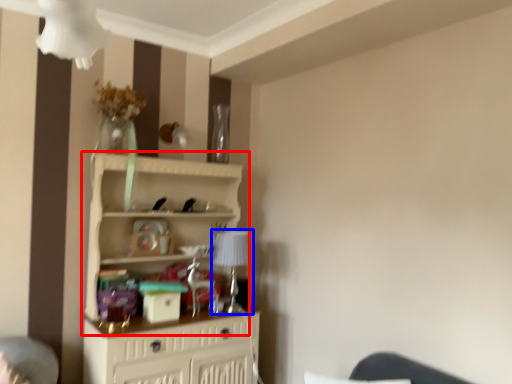
Question: Which object is closer to the camera taking this photo, shelf (highlighted by a red box) or table lamp (highlighted by a blue box)?

Choices:
 (A) shelf
 (B) table lamp

Answer: (A)